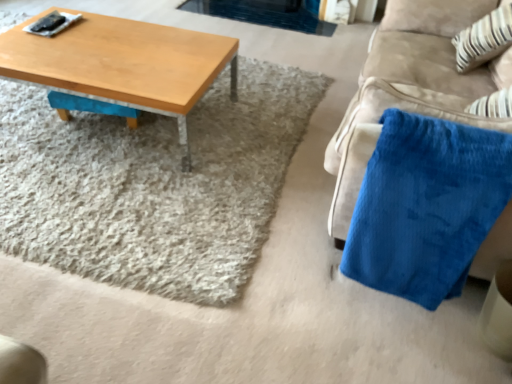
Question: In terms of height, does light brown wood coffee table at upper left look taller or shorter compared to velvety blue blanket at right?

Choices:
 (A) tall
 (B) short

Answer: (B)

Question: From a real-world perspective, is light brown wood coffee table at upper left above or below velvety blue blanket at right?

Choices:
 (A) above
 (B) below

Answer: (B)

Question: Estimate the real-world distances between objects in this image. Which object is closer to the light brown wood coffee table at upper left?

Choices:
 (A) white striped fabric at upper right
 (B) velvety blue blanket at right

Answer: (B)

Question: Based on their relative distances, which object is farther from the white striped fabric at upper right?

Choices:
 (A) light brown wood coffee table at upper left
 (B) velvety blue blanket at right

Answer: (A)